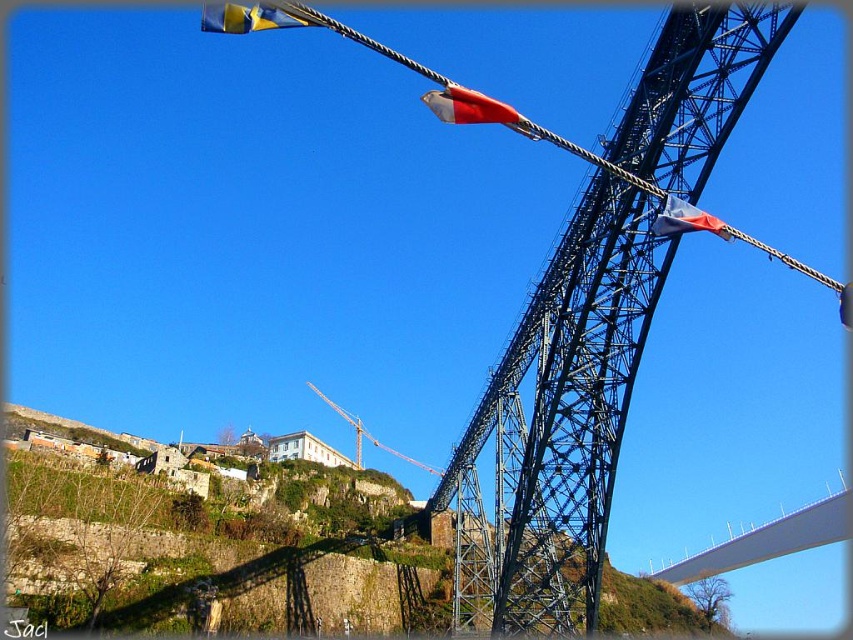
Between white smooth bridge at center and yellow fabric flag at upper left, which one has more height?

With more height is white smooth bridge at center.

This screenshot has width=853, height=640. Find the location of `white smooth bridge at center`. white smooth bridge at center is located at coordinates (767, 540).

Between point (482, 115) and point (379, 444), which one is positioned in front?

Point (482, 115)

Between red fabric flag at upper center and yellow metallic crane at center, which one is positioned higher?

red fabric flag at upper center is higher up.

Does point (520, 115) come closer to viewer compared to point (426, 465)?

Yes, it is in front of point (426, 465).

Where is `red fabric flag at upper center`? Image resolution: width=853 pixels, height=640 pixels. red fabric flag at upper center is located at coordinates (469, 108).

Based on the photo, does red fabric flag at upper center have a lesser width compared to blue fabric flag at upper right?

In fact, red fabric flag at upper center might be wider than blue fabric flag at upper right.

Which is in front, point (451, 108) or point (672, 220)?

Point (451, 108) is more forward.

At what (x,y) coordinates should I click in order to perform the action: click on red fabric flag at upper center. Please return your answer as a coordinate pair (x, y). This screenshot has height=640, width=853. Looking at the image, I should click on (469, 108).

This screenshot has height=640, width=853. In order to click on red fabric flag at upper center in this screenshot , I will do `click(469, 108)`.